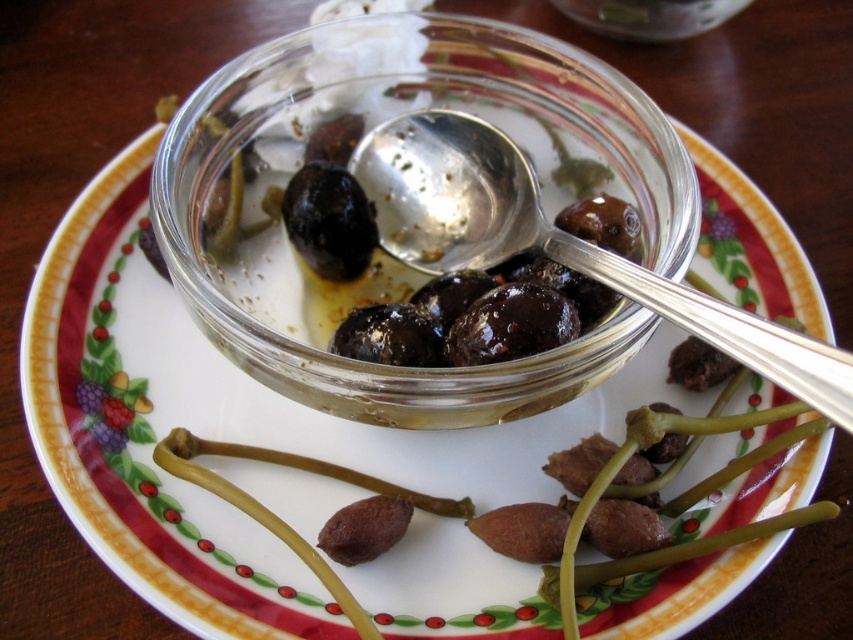
You are a chef arranging a platter and need to place a decorative plate with a bowl of olives. The bowl must be placed exactly at coordinates point (x=375, y=124). Where should you position the transparent glass bowl at center on the plate?

The transparent glass bowl at center should be positioned exactly at point (x=375, y=124) on the plate.

You are an interior designer analyzing the placement of items in this still life arrangement. The transparent glass bowl at center is part of the composition. Can you determine its exact 2D coordinates based on the image?

The transparent glass bowl at center is located at the 2D coordinates point (375, 124).

You are a chef preparing a dish and need to place the transparent glass bowl at center on a shelf that is 20 centimeters wide. Can the bowl fit on the shelf?

The transparent glass bowl at center is 22.40 centimeters wide, so it cannot fit on a 20 centimeter wide shelf.